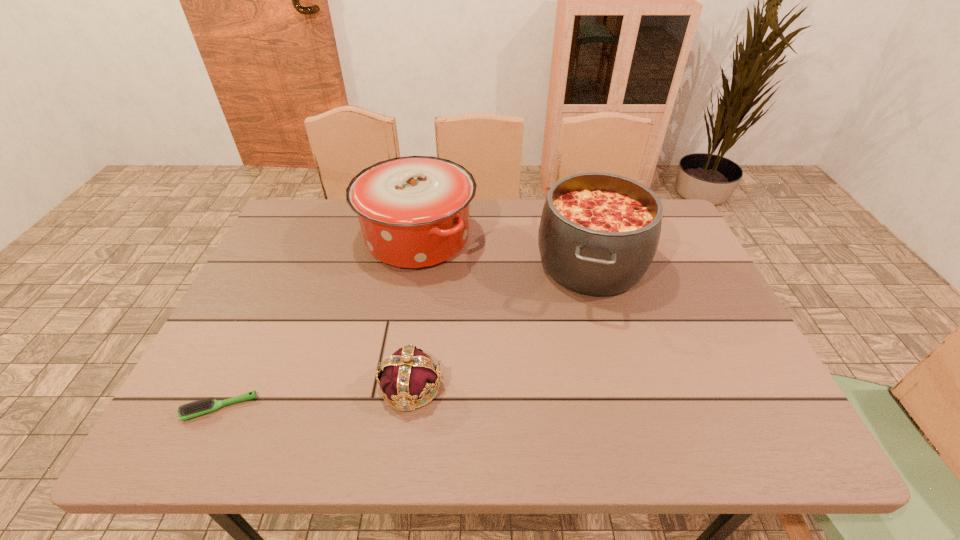
Locate an element on the screen. the left casserole is located at coordinates (413, 211).

Locate an element on the screen. This screenshot has width=960, height=540. the right casserole is located at coordinates (599, 232).

I want to click on the second shortest object, so click(x=409, y=374).

You are a GUI agent. You are given a task and a screenshot of the screen. Output one action in this format:
    pyautogui.click(x=<x>, y=<y>)
    Task: Click on the hairbrush
    
    Given the screenshot: What is the action you would take?
    pyautogui.click(x=203, y=406)

You are a GUI agent. You are given a task and a screenshot of the screen. Output one action in this format:
    pyautogui.click(x=<x>, y=<y>)
    Task: Click on the shortest object
    This screenshot has height=540, width=960.
    Given the screenshot: What is the action you would take?
    pyautogui.click(x=203, y=406)

You are a GUI agent. You are given a task and a screenshot of the screen. Output one action in this format:
    pyautogui.click(x=<x>, y=<y>)
    Task: Click on the free region located 0.210m on the right of the left casserole
    The image size is (960, 540).
    Given the screenshot: What is the action you would take?
    pyautogui.click(x=548, y=238)

You are a GUI agent. You are given a task and a screenshot of the screen. Output one action in this format:
    pyautogui.click(x=<x>, y=<y>)
    Task: Click on the free location located 0.060m on the back of the right casserole
    
    Given the screenshot: What is the action you would take?
    576,211

Where is `vacant space situated 0.320m on the left of the crown`? This screenshot has width=960, height=540. vacant space situated 0.320m on the left of the crown is located at coordinates (226, 386).

Find the location of a particular element. free space located on the back of the leftmost object is located at coordinates (253, 337).

The height and width of the screenshot is (540, 960). What are the coordinates of `crown at the near edge` in the screenshot? It's located at (409, 374).